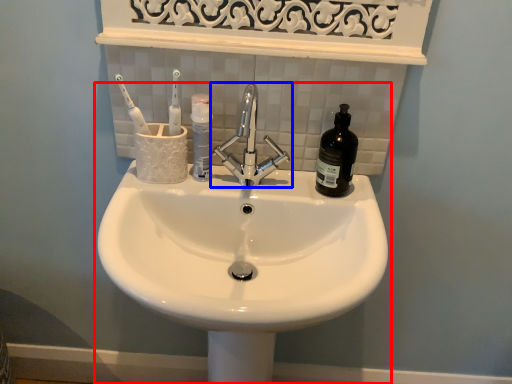
Question: Which object appears farthest to the camera in this image, sink (highlighted by a red box) or tap (highlighted by a blue box)?

Choices:
 (A) sink
 (B) tap

Answer: (B)